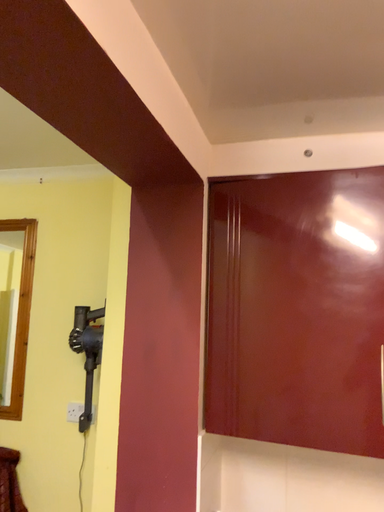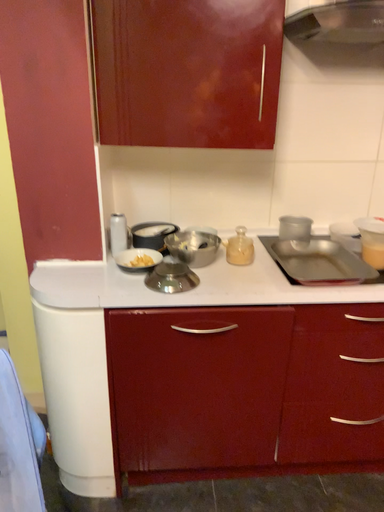
Question: How did the camera likely rotate when shooting the video?

Choices:
 (A) rotated left
 (B) rotated right

Answer: (B)